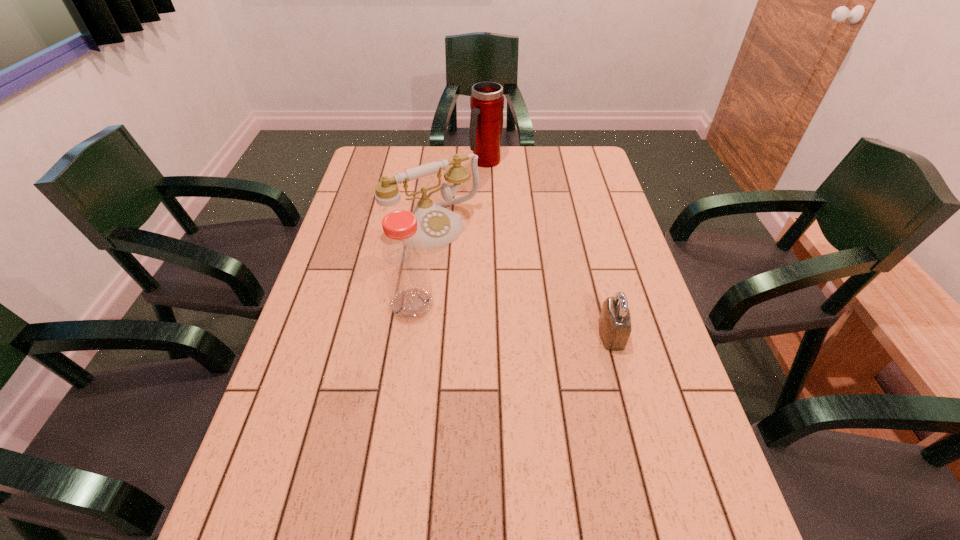
Find the location of a particular element. free space on the desktop that is between the bottle and the padlock and is positioned on the side with the handle of the farthest object is located at coordinates (523, 321).

Where is `free space on the desktop that is between the bottle and the rightmost object and is positioned on the dial of the third nearest object`? This screenshot has height=540, width=960. free space on the desktop that is between the bottle and the rightmost object and is positioned on the dial of the third nearest object is located at coordinates (513, 319).